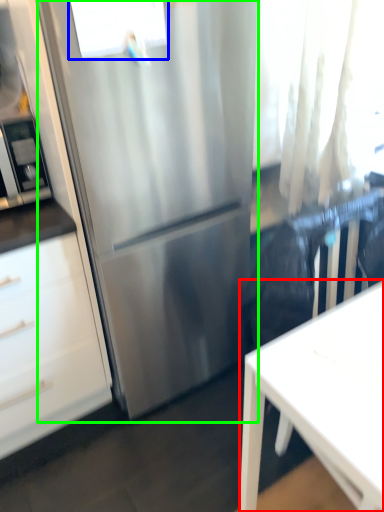
Question: Which object is positioned closest to desk (highlighted by a red box)? Select from window (highlighted by a blue box) and refrigerator (highlighted by a green box).

Choices:
 (A) window
 (B) refrigerator

Answer: (B)